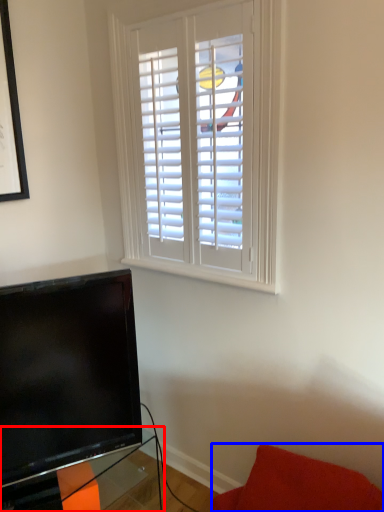
Question: Among these objects, which one is farthest to the camera, table (highlighted by a red box) or furniture (highlighted by a blue box)?

Choices:
 (A) table
 (B) furniture

Answer: (A)